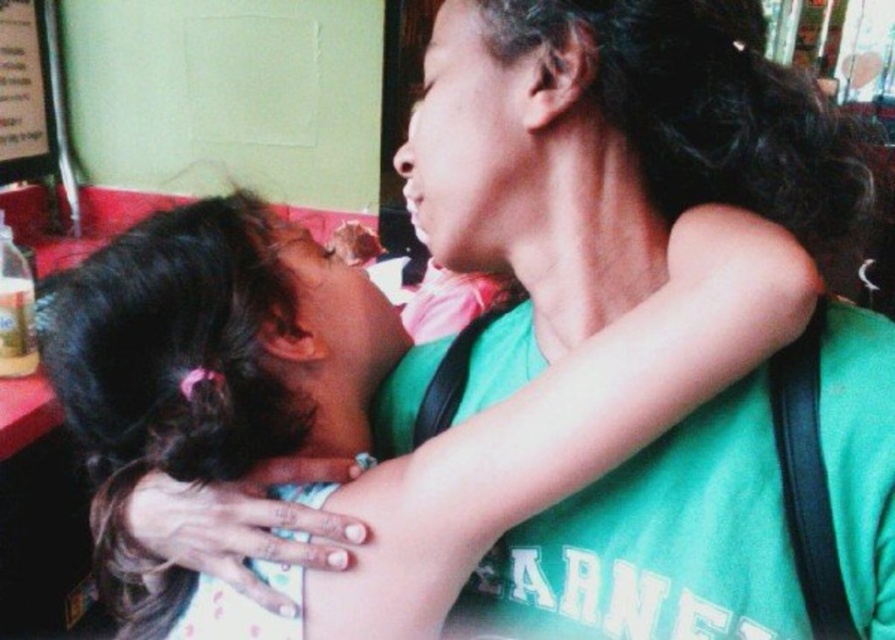
Question: From the image, what is the correct spatial relationship of dark brown hair at upper left in relation to metallic silver sign at upper left?

Choices:
 (A) left
 (B) right

Answer: (B)

Question: Which point is closer to the camera?

Choices:
 (A) metallic silver sign at upper left
 (B) dark brown hair at upper left

Answer: (B)

Question: Considering the relative positions of dark brown hair at upper left and metallic silver sign at upper left in the image provided, where is dark brown hair at upper left located with respect to metallic silver sign at upper left?

Choices:
 (A) left
 (B) right

Answer: (B)

Question: Is dark brown hair at upper left closer to the viewer compared to metallic silver sign at upper left?

Choices:
 (A) yes
 (B) no

Answer: (A)